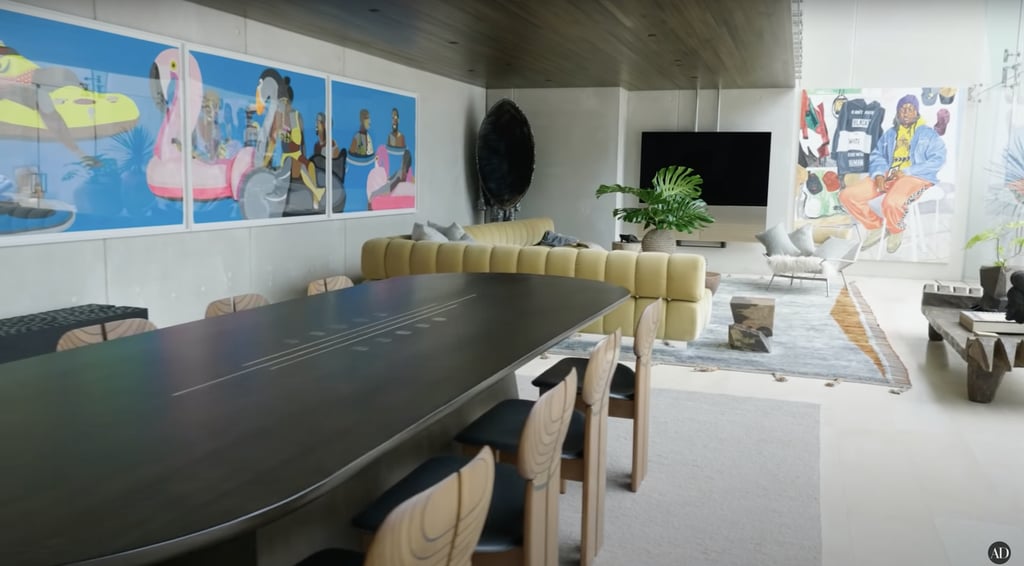
This screenshot has width=1024, height=566. In order to click on dining chairs in this screenshot , I will do `click(443, 544)`, `click(545, 428)`, `click(594, 379)`, `click(645, 332)`, `click(123, 321)`, `click(241, 301)`, `click(333, 280)`.